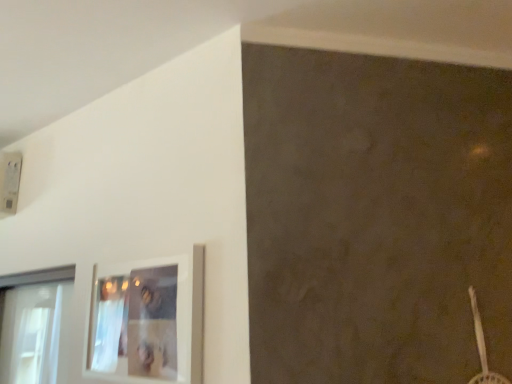
Describe the element at coordinates (147, 321) in the screenshot. I see `white matte picture frame at lower left` at that location.

Where is `white matte picture frame at lower left`? This screenshot has width=512, height=384. white matte picture frame at lower left is located at coordinates (147, 321).

The height and width of the screenshot is (384, 512). I want to click on white matte picture frame at lower left, so click(x=147, y=321).